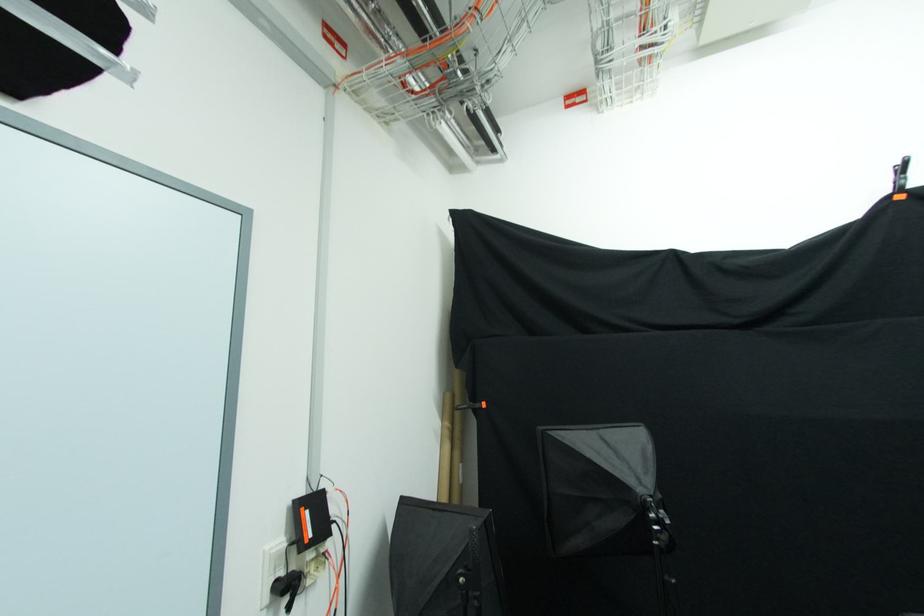
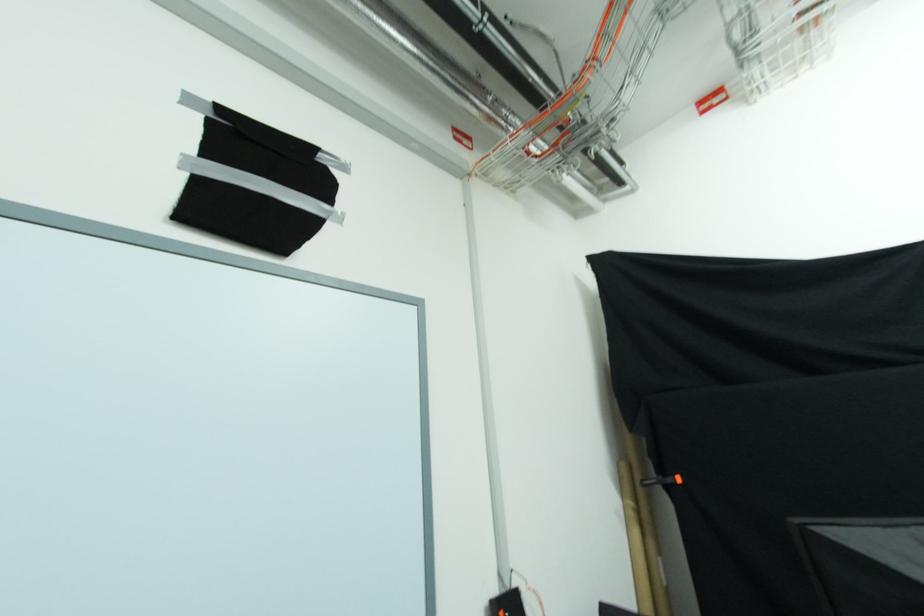
Question: In a continuous first-person perspective shot, in which direction is the camera moving?

Choices:
 (A) Left
 (B) Right
 (C) Forward
 (D) Backward

Answer: (A)